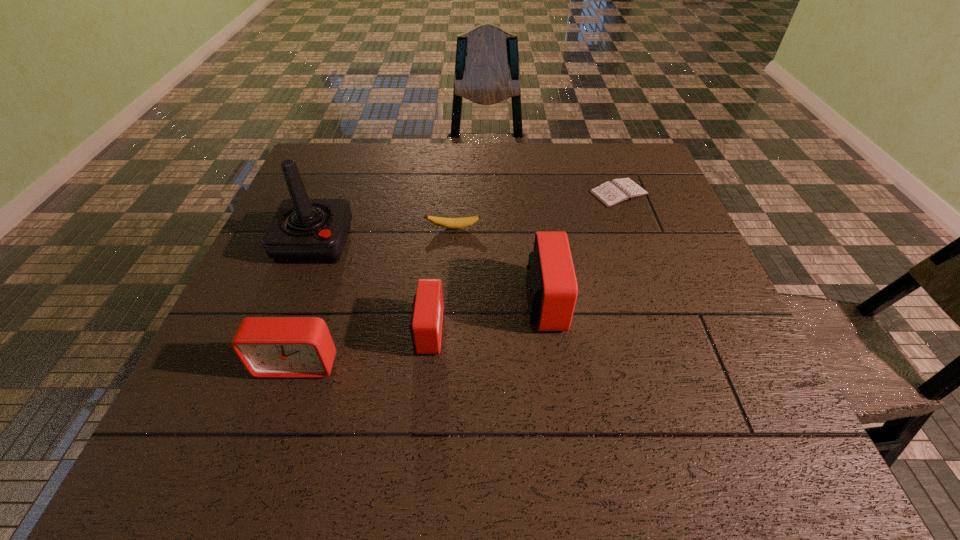
Considering the uniform spacing of alarm clocks, where should an additional alarm clock be positioned on the right? Please locate a free spot. Please provide its 2D coordinates. Your answer should be formatted as a tuple, i.e. [(x, y)], where the tuple contains the x and y coordinates of a point satisfying the conditions above.

[(649, 278)]